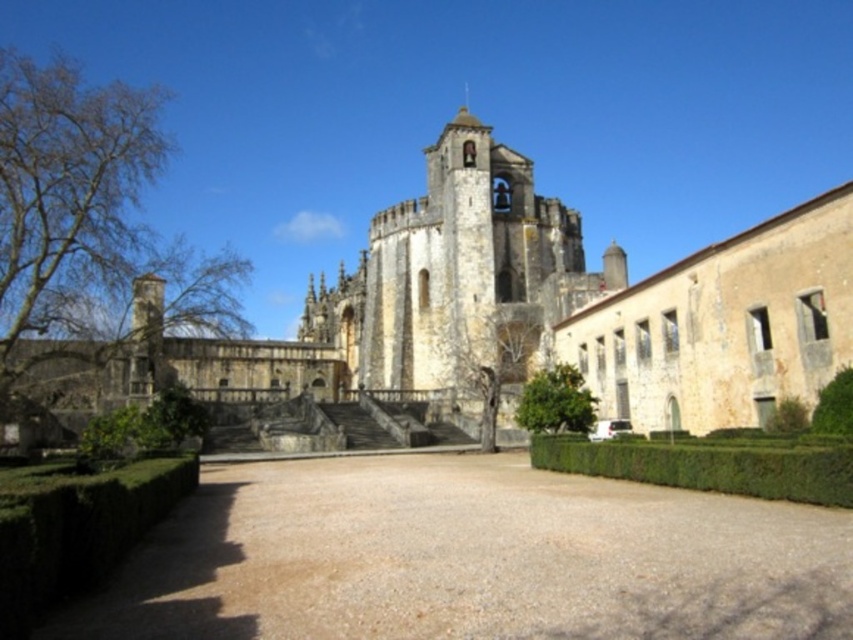
Question: Is green leafy hedge at lower left positioned before bare wood tree at center?

Choices:
 (A) yes
 (B) no

Answer: (A)

Question: Does stone church at center appear on the right side of green leafy tree at center?

Choices:
 (A) yes
 (B) no

Answer: (B)

Question: Which point is farther to the camera?

Choices:
 (A) (9, 557)
 (B) (553, 464)
 (C) (67, 90)
 (D) (480, 356)

Answer: (D)

Question: Among these points, which one is nearest to the camera?

Choices:
 (A) (454, 380)
 (B) (84, 328)
 (C) (503, 348)
 (D) (3, 580)

Answer: (D)

Question: Is bare branches at left bigger than bare wood tree at center?

Choices:
 (A) no
 (B) yes

Answer: (B)

Question: Which object is closer to the camera taking this photo?

Choices:
 (A) green leafy hedge at lower right
 (B) light beige stone church at center
 (C) brown gravel driveway at center

Answer: (C)